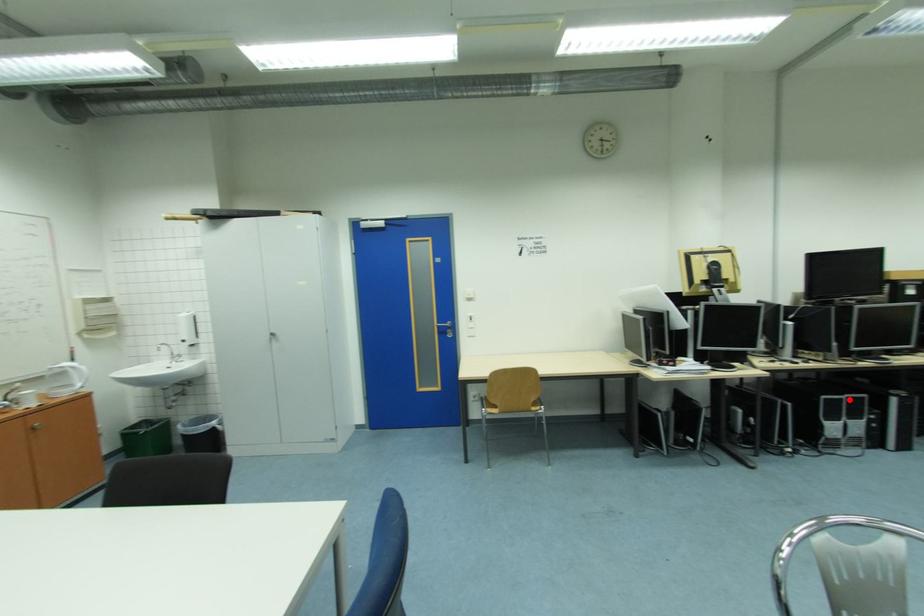
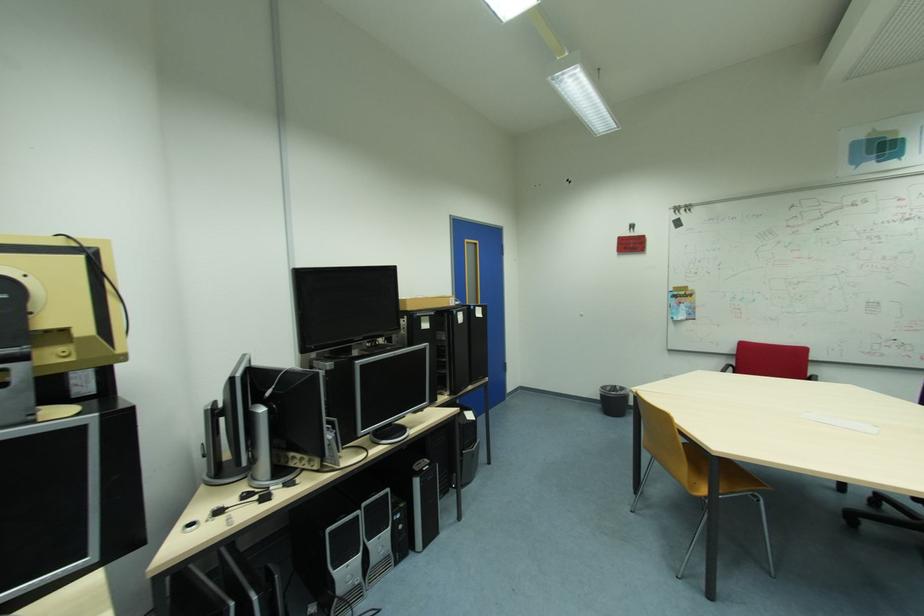
The point at the highlighted location is marked in the first image. Where is the corresponding point in the second image?

(365, 517)